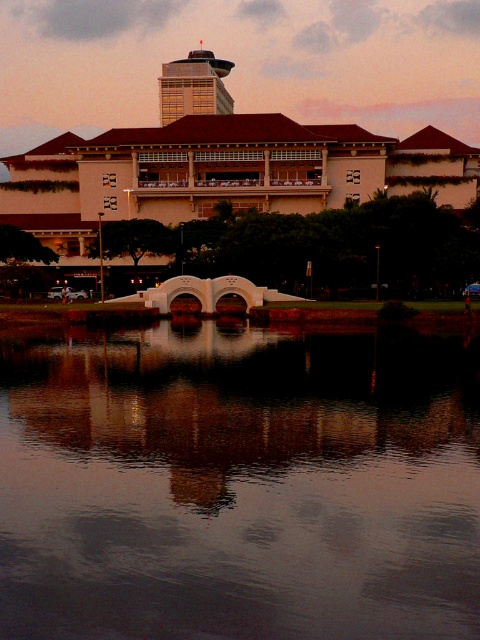
You are a photographer trying to capture the matte beige building at center and the smooth reflective water at center in a single shot. Which object will appear taller in the photograph?

The matte beige building at center will appear taller in the photograph because it has a greater height compared to the smooth reflective water at center.

You are a tourist standing on the white, arched bridge and want to take a photo of the matte beige building at center and the smooth reflective water at center. Which object should you position to your left to include both in the frame?

You should position the matte beige building at center to your left since the smooth reflective water at center is on its right side, allowing both to be captured in the photo.

You are standing on the white arched bridge and want to take a photo of the matte beige building at center and its reflection in the smooth reflective water at center. Which object should you focus on first to capture both the building and its reflection clearly?

You should focus on the matte beige building at center first because the smooth reflective water at center is below it, ensuring the reflection will be in the same frame when the building is in focus.